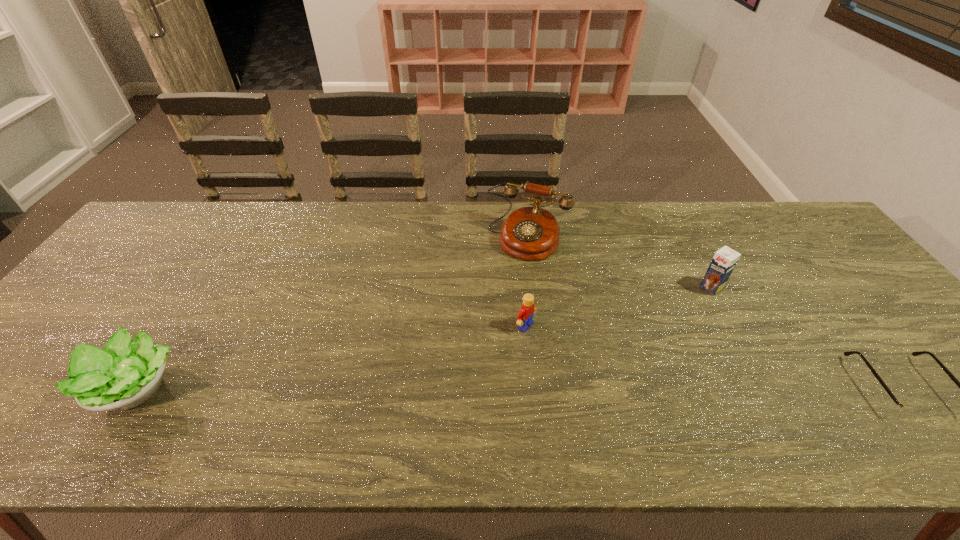
The width and height of the screenshot is (960, 540). Find the location of `free spot on the desktop that is between the leftmost object and the spectacles and is positioned on the dial of the farthest object`. free spot on the desktop that is between the leftmost object and the spectacles and is positioned on the dial of the farthest object is located at coordinates (456, 387).

Locate an element on the screen. The width and height of the screenshot is (960, 540). vacant space on the desktop that is between the leftmost object and the shortest object and is positioned on the face of the third farthest object is located at coordinates (627, 387).

This screenshot has width=960, height=540. In order to click on vacant spot on the desktop that is between the lettuce and the rightmost object and is positioned on the front label of the second tallest object in this screenshot , I will do `click(574, 387)`.